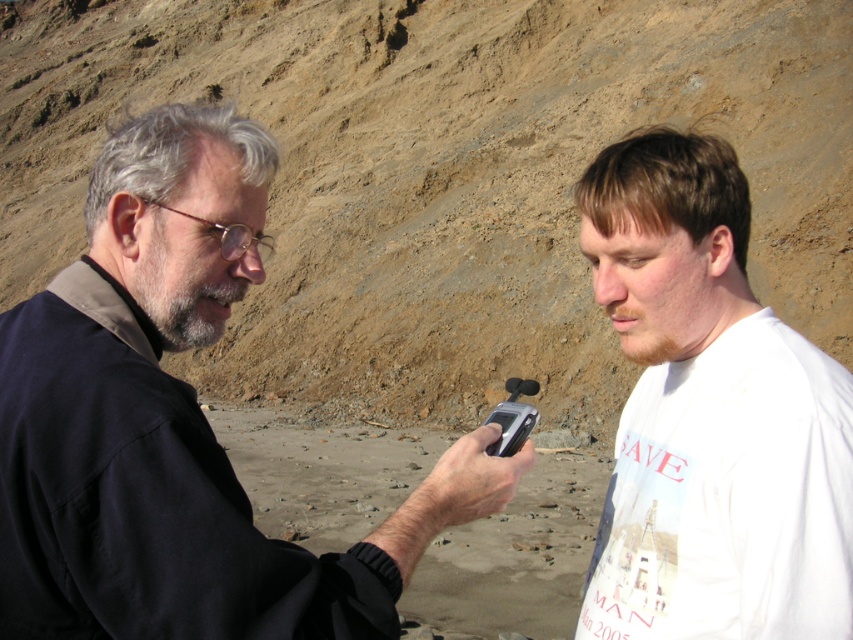
Question: Is matte black jacket at left thinner than white cotton t-shirt at right?

Choices:
 (A) no
 (B) yes

Answer: (A)

Question: In this image, where is matte black jacket at left located relative to white cotton t-shirt at right?

Choices:
 (A) below
 (B) above

Answer: (B)

Question: Which of the following is the closest to the observer?

Choices:
 (A) matte black jacket at left
 (B) white cotton t-shirt at right

Answer: (A)

Question: From the image, what is the correct spatial relationship of matte black jacket at left in relation to white cotton t-shirt at right?

Choices:
 (A) above
 (B) below

Answer: (A)

Question: Which point is closer to the camera?

Choices:
 (A) white cotton t-shirt at right
 (B) matte black jacket at left

Answer: (B)